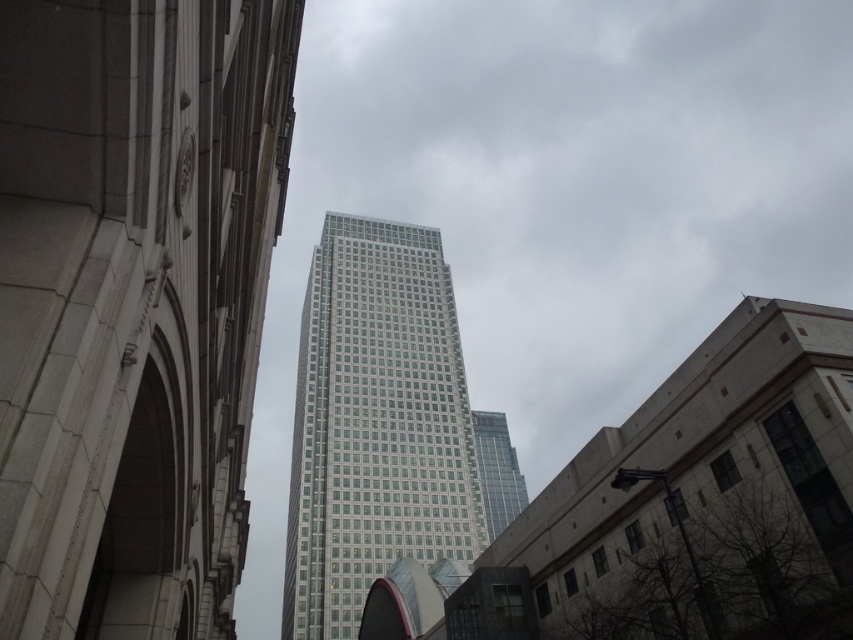
Question: Which point is closer to the camera?

Choices:
 (A) clear glass skyscraper at center
 (B) white glass tower at center

Answer: (B)

Question: Can you confirm if white glass tower at center is wider than clear glass skyscraper at center?

Choices:
 (A) no
 (B) yes

Answer: (B)

Question: Can you confirm if white glass tower at center is positioned below clear glass skyscraper at center?

Choices:
 (A) yes
 (B) no

Answer: (B)

Question: Among these objects, which one is farthest from the camera?

Choices:
 (A) clear glass skyscraper at center
 (B) white glass tower at center

Answer: (A)

Question: Which point is closer to the camera taking this photo?

Choices:
 (A) (374, 531)
 (B) (479, 435)

Answer: (A)

Question: Is white glass tower at center bigger than clear glass skyscraper at center?

Choices:
 (A) no
 (B) yes

Answer: (B)